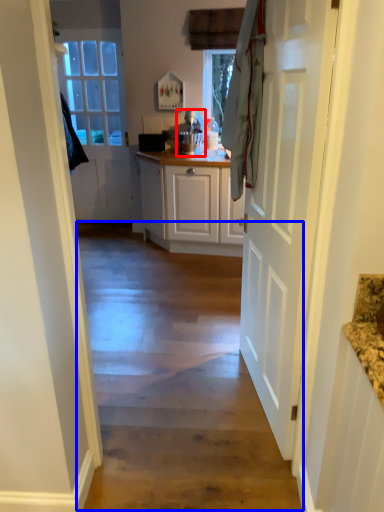
Question: Among these objects, which one is nearest to the camera, appliance (highlighted by a red box) or path (highlighted by a blue box)?

Choices:
 (A) appliance
 (B) path

Answer: (B)